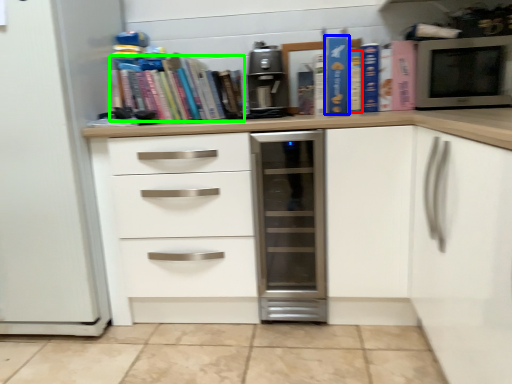
Question: Which object is positioned closest to paperback book (highlighted by a red box)? Select from paperback book (highlighted by a blue box) and book (highlighted by a green box).

Choices:
 (A) paperback book
 (B) book

Answer: (A)